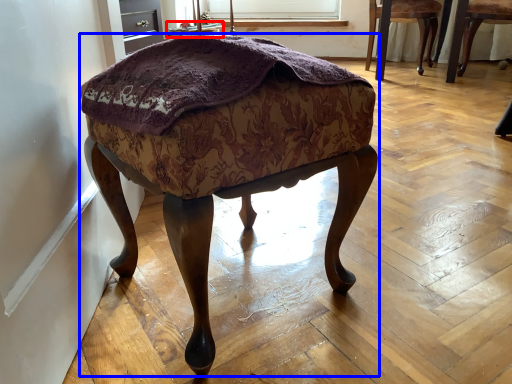
Question: Among these objects, which one is nearest to the camera, side table (highlighted by a red box) or stool (highlighted by a blue box)?

Choices:
 (A) side table
 (B) stool

Answer: (B)